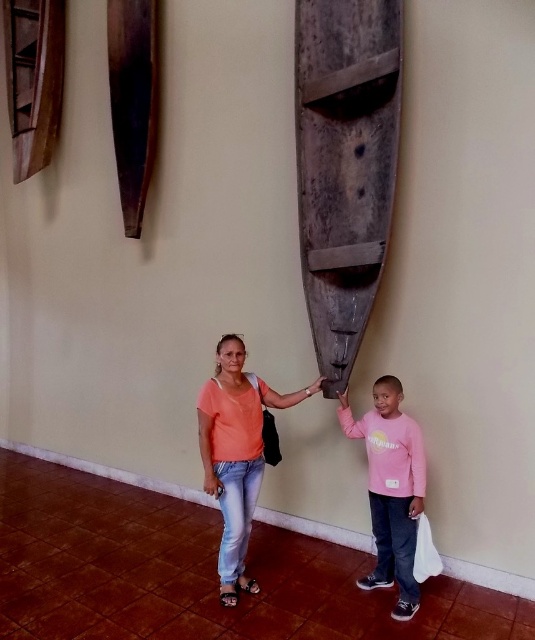
Who is positioned more to the left, dark brown wood boat at center or matte orange shirt at center?

Positioned to the left is matte orange shirt at center.

Does dark brown wood boat at center appear under matte orange shirt at center?

Actually, dark brown wood boat at center is above matte orange shirt at center.

Does point (399, 124) lie in front of point (238, 376)?

Yes, point (399, 124) is closer to viewer.

I want to click on dark brown wood boat at center, so click(x=345, y=164).

Does matte orange shirt at center have a larger size compared to pink cotton shirt at center?

Answer: Yes.

Locate an element on the screen. matte orange shirt at center is located at coordinates (235, 452).

Is point (350, 176) closer to viewer compared to point (417, 442)?

No, (350, 176) is further to viewer.

Where is `dark brown wood boat at center`? dark brown wood boat at center is located at coordinates (345, 164).

The height and width of the screenshot is (640, 535). I want to click on dark brown wood boat at center, so click(x=345, y=164).